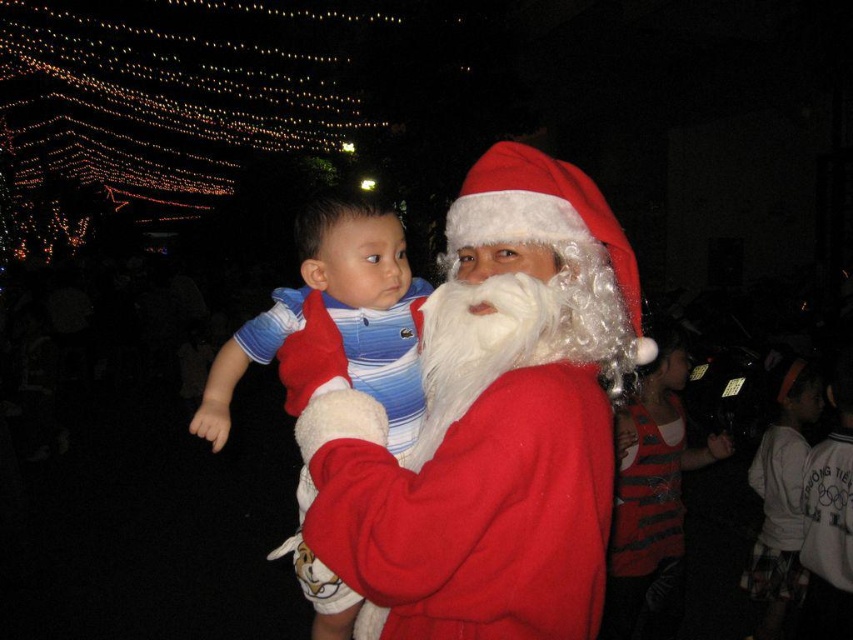
Question: Is red velvet santa at center closer to camera compared to blue striped shirt at center?

Choices:
 (A) yes
 (B) no

Answer: (A)

Question: Which of the following is the farthest from the observer?

Choices:
 (A) (577, 292)
 (B) (364, 252)

Answer: (B)

Question: Can you confirm if red velvet santa at center is bigger than blue striped shirt at center?

Choices:
 (A) yes
 (B) no

Answer: (A)

Question: Is red velvet santa at center to the right of blue striped shirt at center from the viewer's perspective?

Choices:
 (A) yes
 (B) no

Answer: (A)

Question: Which of the following is the farthest from the observer?

Choices:
 (A) blue striped shirt at center
 (B) red velvet santa at center

Answer: (A)

Question: Among these points, which one is farthest from the camera?

Choices:
 (A) (242, 323)
 (B) (485, 605)

Answer: (A)